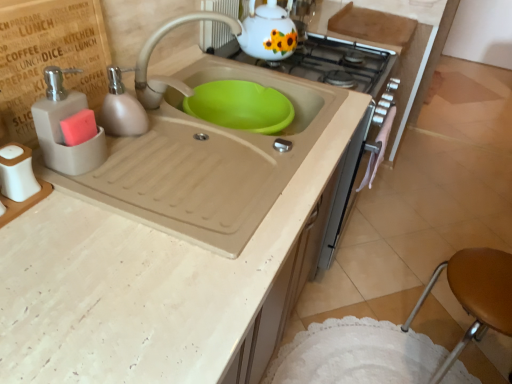
At what (x,y) coordinates should I click in order to perform the action: click on free location in front of matte beige faucet at sink center. Please return your answer as a coordinate pair (x, y). This screenshot has height=384, width=512. Looking at the image, I should click on (196, 148).